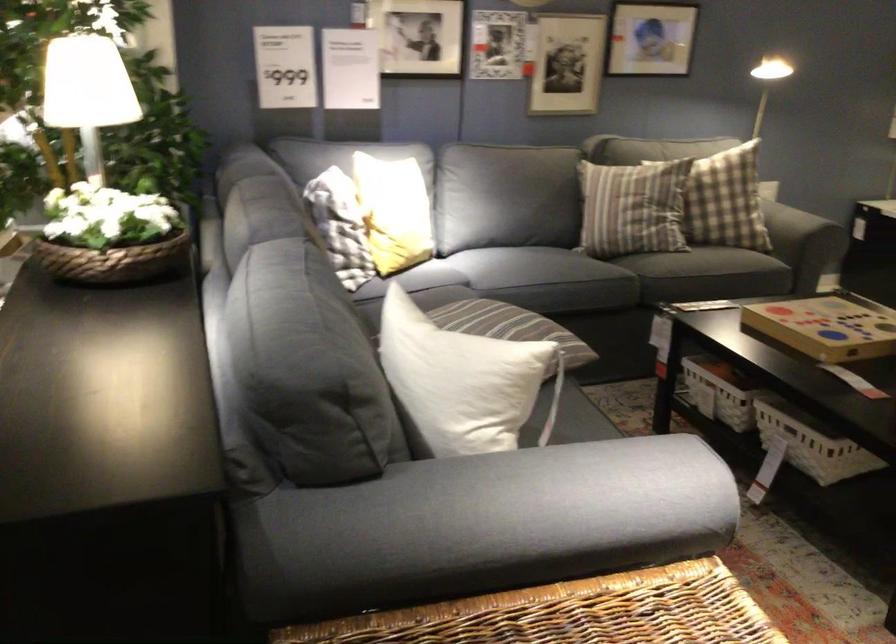
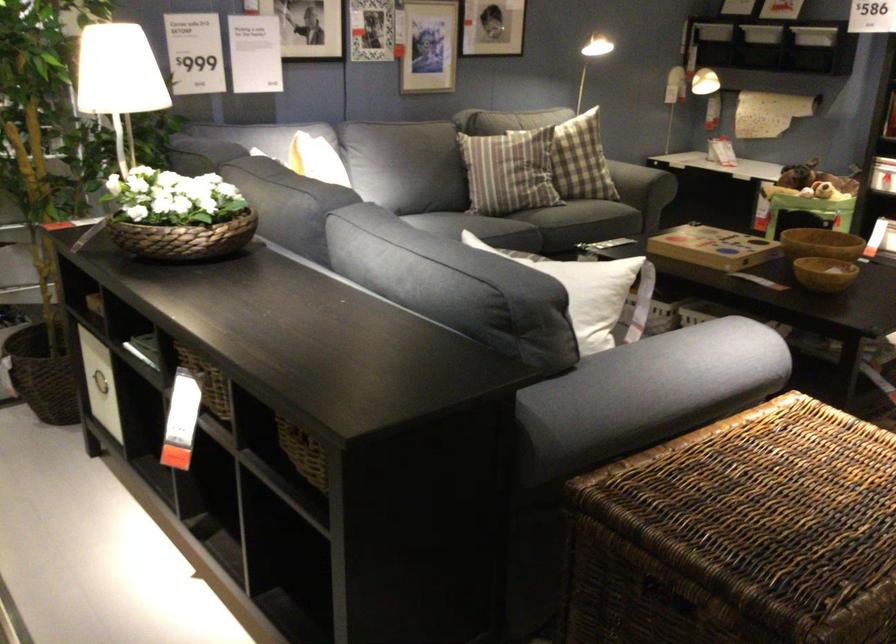
Locate, in the second image, the point that corresponds to point (613, 190) in the first image.

(507, 172)